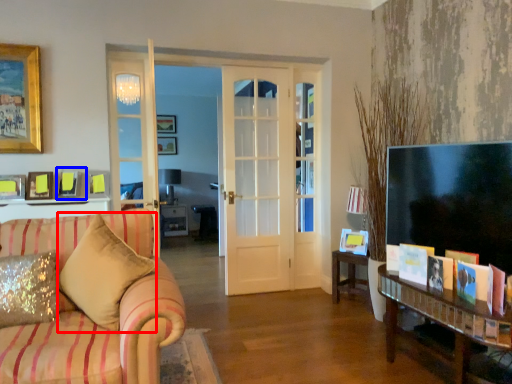
Question: Which object is closer to the camera taking this photo, pillow (highlighted by a red box) or picture frame (highlighted by a blue box)?

Choices:
 (A) pillow
 (B) picture frame

Answer: (A)